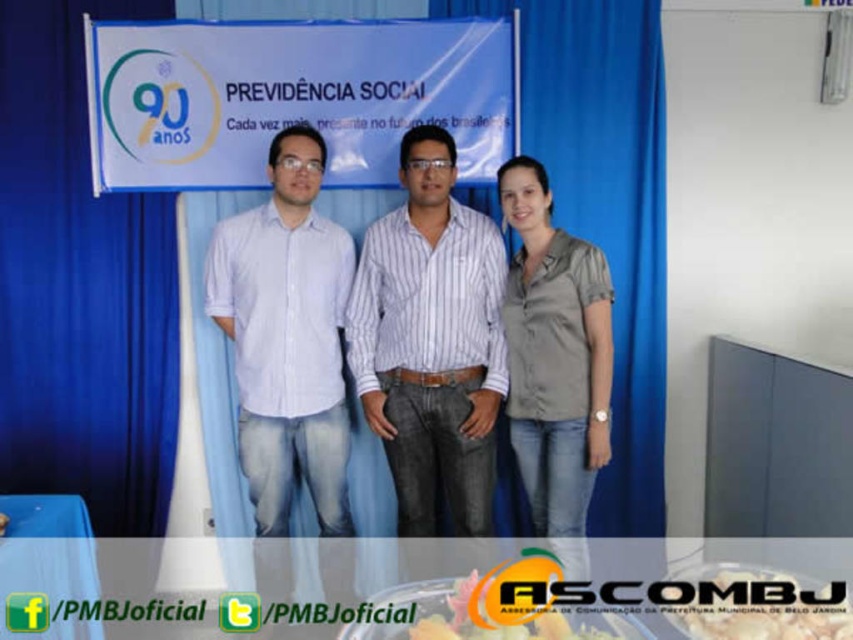
Question: Estimate the real-world distances between objects in this image. Which object is farther from the yellow matte cake at center?

Choices:
 (A) blue plastic table at lower left
 (B) blue fabric curtain at upper center

Answer: (B)

Question: Among these points, which one is nearest to the camera?

Choices:
 (A) (648, 316)
 (B) (171, 408)
 (C) (709, 621)

Answer: (C)

Question: Is gray matte shirt at center further to camera compared to yellow matte cake at center?

Choices:
 (A) yes
 (B) no

Answer: (A)

Question: Is blue fabric curtain at left above yellow matte cake at center?

Choices:
 (A) no
 (B) yes

Answer: (B)

Question: Considering the real-world distances, which object is closest to the striped cotton shirt at center?

Choices:
 (A) blue fabric curtain at left
 (B) blue fabric curtain at center

Answer: (B)

Question: Is blue fabric curtain at center to the left of yellow matte cake at center from the viewer's perspective?

Choices:
 (A) yes
 (B) no

Answer: (B)